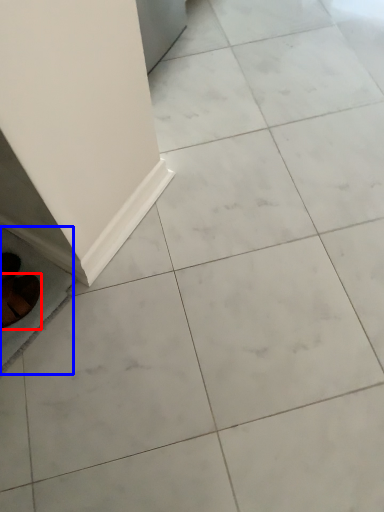
Question: Which object appears farthest to the camera in this image, footwear (highlighted by a red box) or ceramic tile (highlighted by a blue box)?

Choices:
 (A) footwear
 (B) ceramic tile

Answer: (B)